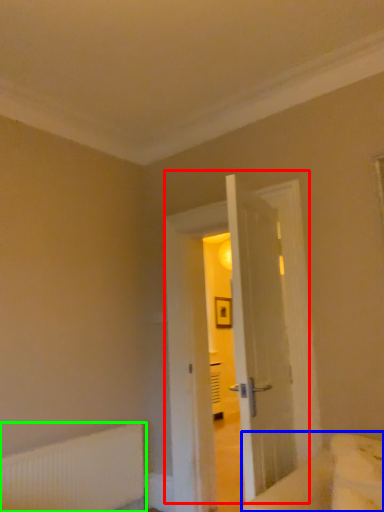
Question: Considering the real-world distances, which object is closest to door (highlighted by a red box)? bed (highlighted by a blue box) or radiator (highlighted by a green box).

Choices:
 (A) bed
 (B) radiator

Answer: (B)